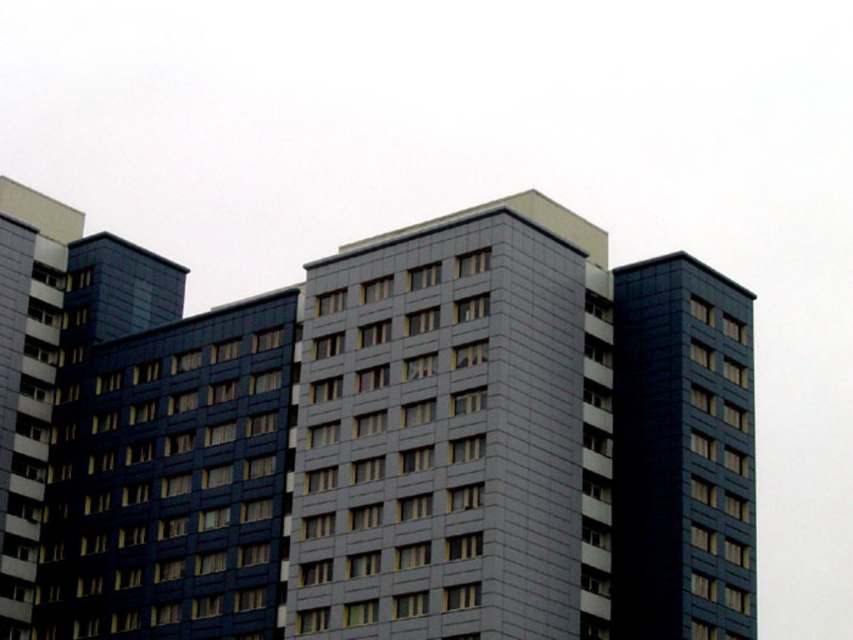
Question: Can you confirm if slate gray concrete building at center is positioned to the left of matte dark blue building at right?

Choices:
 (A) yes
 (B) no

Answer: (A)

Question: Does slate gray concrete building at center have a smaller size compared to matte dark blue building at right?

Choices:
 (A) no
 (B) yes

Answer: (A)

Question: Does slate gray concrete building at center lie behind matte dark blue building at right?

Choices:
 (A) no
 (B) yes

Answer: (A)

Question: Among these points, which one is farthest from the camera?

Choices:
 (A) (718, 634)
 (B) (606, 544)

Answer: (B)

Question: Among these objects, which one is nearest to the camera?

Choices:
 (A) slate gray concrete building at center
 (B) matte dark blue building at right

Answer: (A)